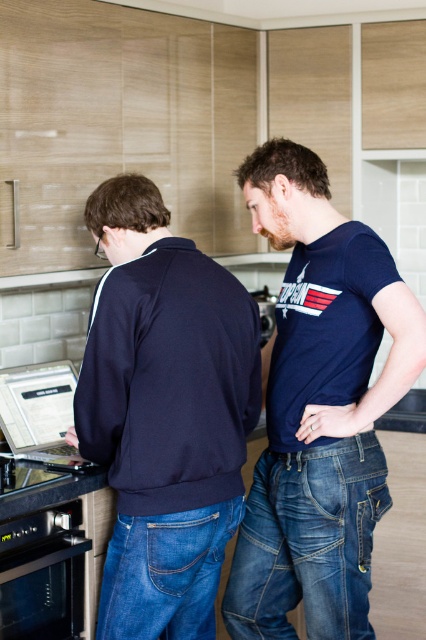
Question: Is dark blue t-shirt at center smaller than black stainless steel oven at lower left?

Choices:
 (A) yes
 (B) no

Answer: (B)

Question: Where is black stainless steel oven at lower left located in relation to silver metallic laptop at left in the image?

Choices:
 (A) left
 (B) right

Answer: (B)

Question: Estimate the real-world distances between objects in this image. Which object is farther from the dark blue t-shirt at center?

Choices:
 (A) silver metallic laptop at left
 (B) metallic silver toaster at center

Answer: (B)

Question: Based on their relative distances, which object is farther from the dark blue t-shirt at center?

Choices:
 (A) metallic silver toaster at center
 (B) black stainless steel oven at lower left
 (C) silver metallic laptop at left
 (D) navy blue sweatshirt at left

Answer: (A)

Question: Does dark blue t-shirt at center have a lesser width compared to silver metallic laptop at left?

Choices:
 (A) no
 (B) yes

Answer: (A)

Question: Which point appears farthest from the camera in this image?

Choices:
 (A) (373, 499)
 (B) (256, 296)
 (C) (60, 467)

Answer: (B)